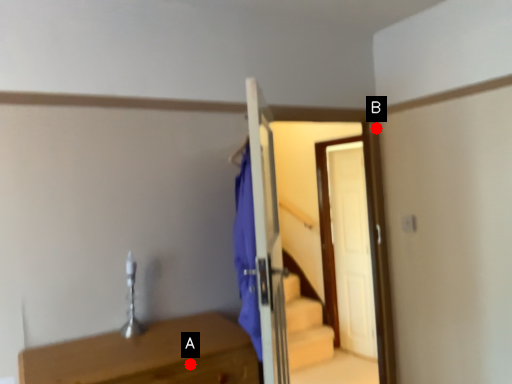
Question: Two points are circled on the image, labeled by A and B beside each circle. Which point is closer to the camera?

Choices:
 (A) A is closer
 (B) B is closer

Answer: (A)